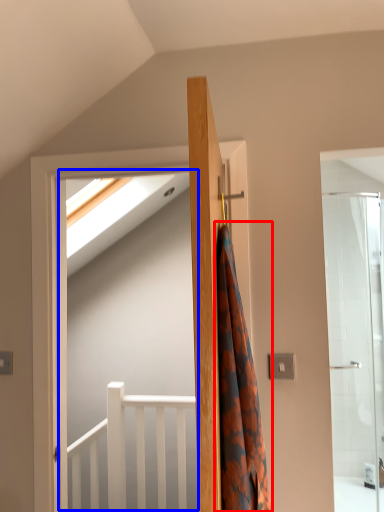
Question: Which point is further to the camera, shower curtain (highlighted by a red box) or screen door (highlighted by a blue box)?

Choices:
 (A) shower curtain
 (B) screen door

Answer: (B)